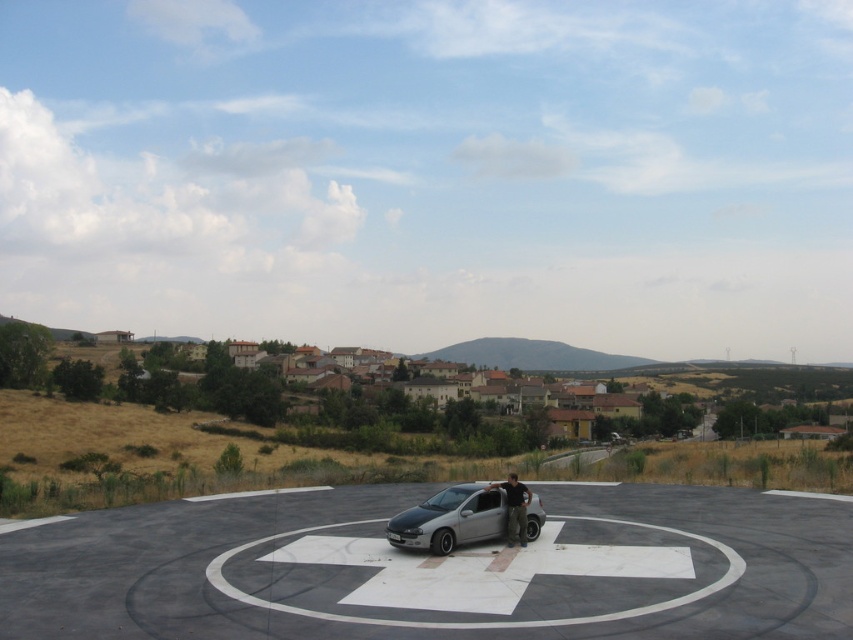
Can you confirm if concrete circle at center is positioned below dark gray fabric pants at center?

Correct, concrete circle at center is located below dark gray fabric pants at center.

Does concrete circle at center appear on the right side of dark gray fabric pants at center?

In fact, concrete circle at center is to the left of dark gray fabric pants at center.

Identify the location of concrete circle at center. Image resolution: width=853 pixels, height=640 pixels. (476, 621).

The width and height of the screenshot is (853, 640). I want to click on concrete circle at center, so click(x=476, y=621).

Who is more distant from viewer, (236,586) or (492,522)?

The point (492,522) is behind.

Which is more to the left, concrete circle at center or silver metallic car at center?

silver metallic car at center is more to the left.

Find the location of a particular element. The height and width of the screenshot is (640, 853). concrete circle at center is located at coordinates (476, 621).

I want to click on concrete circle at center, so click(x=476, y=621).

Who is taller, silver metallic car at center or dark gray fabric pants at center?

silver metallic car at center is taller.

Does silver metallic car at center have a larger size compared to dark gray fabric pants at center?

Correct, silver metallic car at center is larger in size than dark gray fabric pants at center.

Does point (401, 520) lie in front of point (515, 525)?

Yes, it is in front of point (515, 525).

Image resolution: width=853 pixels, height=640 pixels. I want to click on silver metallic car at center, so click(x=450, y=518).